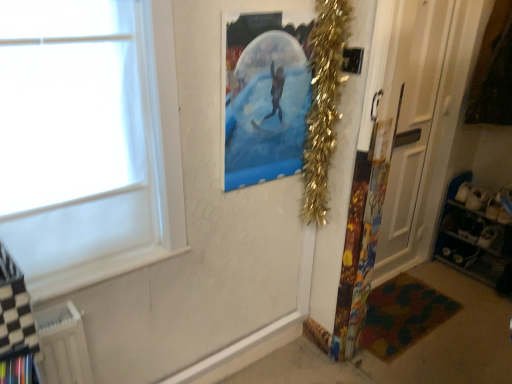
I want to click on free space above multicolored fabric mat at lower right (from a real-world perspective), so click(390, 307).